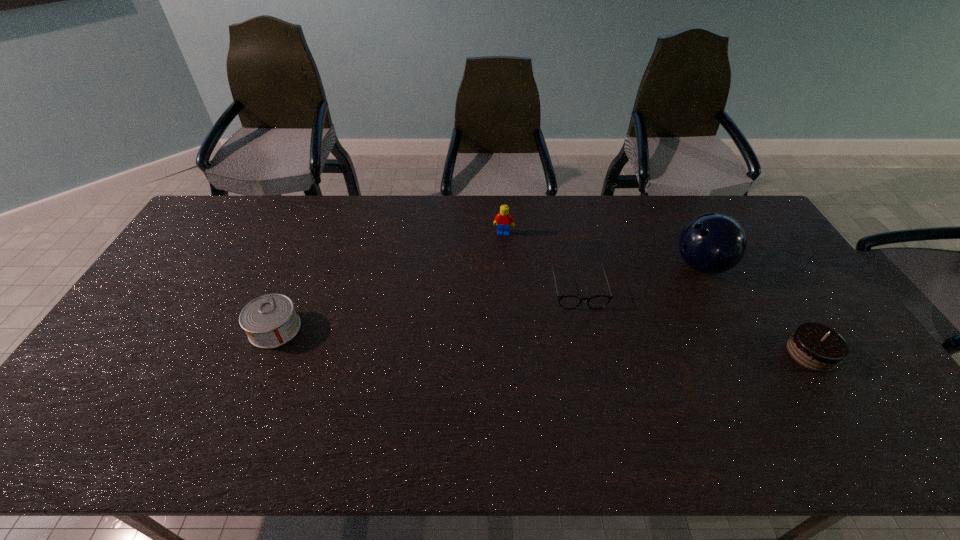
Locate an element on the screen. free space on the desktop that is between the leftmost object and the rightmost object and is positioned through the lenses of the third object from left to right is located at coordinates (590, 343).

This screenshot has width=960, height=540. I want to click on free space on the desktop that is between the can and the third tallest object and is positioned on the surface of the fourth object from left to right near the finger holes, so click(x=564, y=342).

This screenshot has width=960, height=540. In order to click on free space on the desktop that is between the can and the rightmost object and is positioned on the face of the second tallest object in this screenshot , I will do `click(478, 338)`.